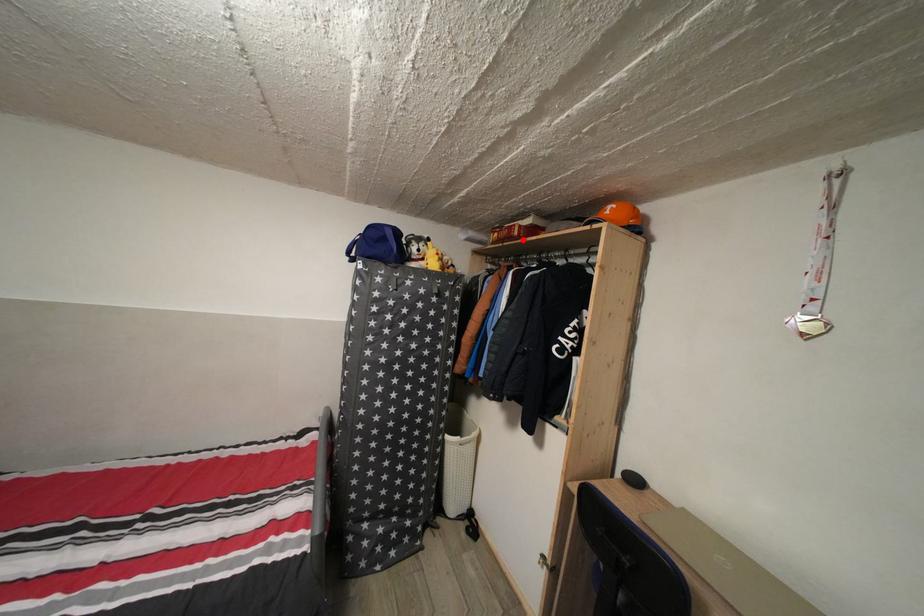
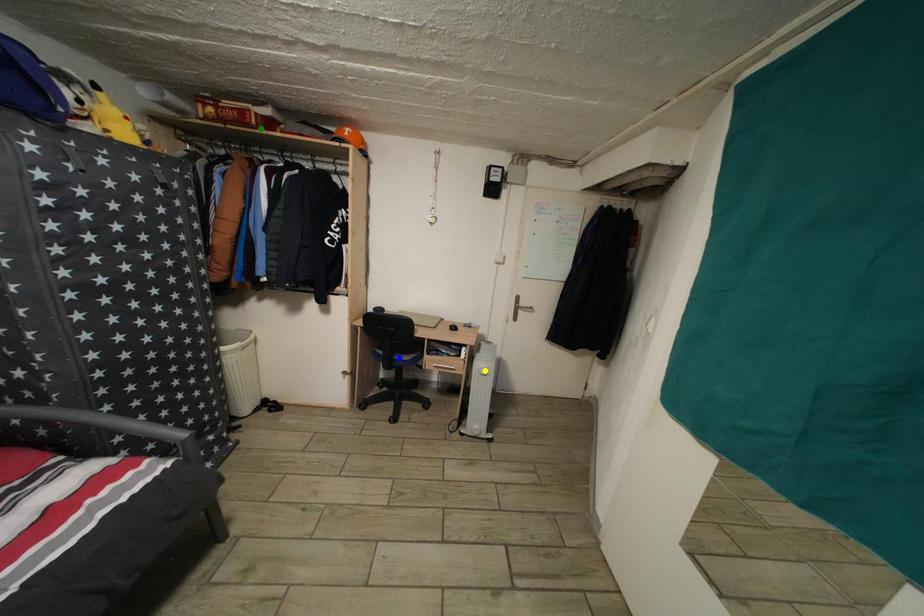
Question: I am providing you with two images of the same scene from different viewpoints. A red point is marked on the first image. You are given multiple points on the second image. In image 2, which mark is for the same physical point as the one in image 1?

Choices:
 (A) blue point
 (B) green point
 (C) yellow point

Answer: (B)